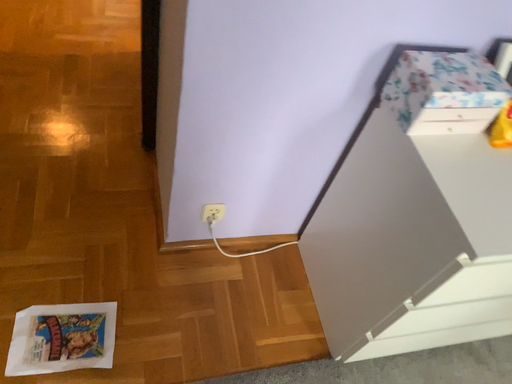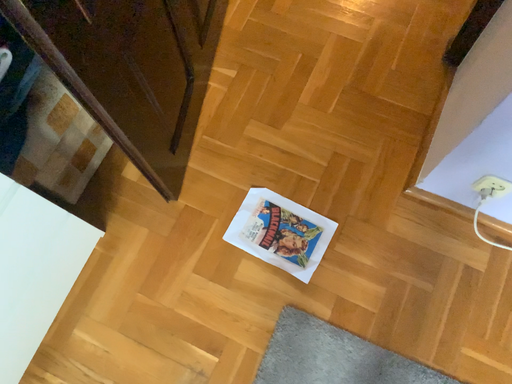
Question: Which way did the camera rotate in the video?

Choices:
 (A) rotated downward
 (B) rotated upward

Answer: (A)